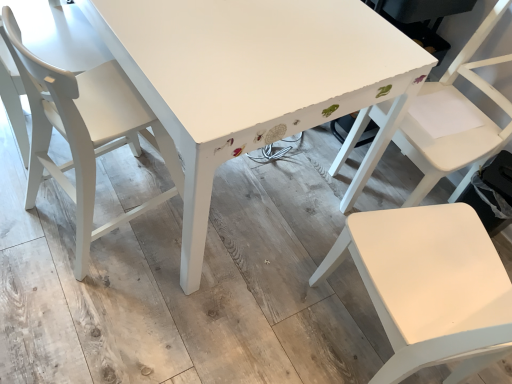
Question: Is white matte chair at right, marked as the 2th chair in a left-to-right arrangement, far from white painted wood table at center?

Choices:
 (A) no
 (B) yes

Answer: (A)

Question: From the image's perspective, is white matte chair at right, the 2th chair when ordered from right to left, on white painted wood table at center?

Choices:
 (A) no
 (B) yes

Answer: (A)

Question: Can you confirm if white matte chair at right, marked as the 2th chair in a left-to-right arrangement, is taller than white painted wood table at center?

Choices:
 (A) yes
 (B) no

Answer: (A)

Question: Is white matte chair at right, marked as the 2th chair in a left-to-right arrangement, facing towards white painted wood table at center?

Choices:
 (A) yes
 (B) no

Answer: (A)

Question: From a real-world perspective, is white matte chair at right, marked as the 2th chair in a left-to-right arrangement, located higher than white painted wood table at center?

Choices:
 (A) no
 (B) yes

Answer: (B)

Question: Considering the positions of white painted wood table at center and matte white chair at left, which is the 1th chair from left to right, in the image, is white painted wood table at center wider or thinner than matte white chair at left, which is the 1th chair from left to right,?

Choices:
 (A) wide
 (B) thin

Answer: (A)

Question: From a real-world perspective, is white painted wood table at center above or below matte white chair at left, positioned as the third chair in right-to-left order?

Choices:
 (A) below
 (B) above

Answer: (A)

Question: Is point (243, 91) closer or farther from the camera than point (10, 39)?

Choices:
 (A) farther
 (B) closer

Answer: (B)

Question: Considering the positions of white painted wood table at center and matte white chair at left, which is the 1th chair from left to right, in the image, is white painted wood table at center taller or shorter than matte white chair at left, which is the 1th chair from left to right,?

Choices:
 (A) tall
 (B) short

Answer: (B)

Question: Based on their sizes in the image, would you say matte white chair at left, which is the 1th chair from left to right, is bigger or smaller than white matte chair at right, marked as the 2th chair in a left-to-right arrangement?

Choices:
 (A) small
 (B) big

Answer: (A)

Question: Would you say matte white chair at left, positioned as the third chair in right-to-left order, is to the left or to the right of white matte chair at right, the 2th chair when ordered from right to left, in the picture?

Choices:
 (A) left
 (B) right

Answer: (A)

Question: Is matte white chair at left, which is the 1th chair from left to right, in front of or behind white matte chair at right, the 2th chair when ordered from right to left, in the image?

Choices:
 (A) front
 (B) behind

Answer: (B)

Question: From the image's perspective, is matte white chair at left, positioned as the third chair in right-to-left order, located above or below white matte chair at right, the 2th chair when ordered from right to left?

Choices:
 (A) above
 (B) below

Answer: (A)

Question: From a real-world perspective, is white painted wood table at center physically located above or below white matte chair at center, the 1th chair when ordered from right to left?

Choices:
 (A) above
 (B) below

Answer: (B)

Question: Is point (271, 107) positioned closer to the camera than point (430, 134)?

Choices:
 (A) closer
 (B) farther

Answer: (A)